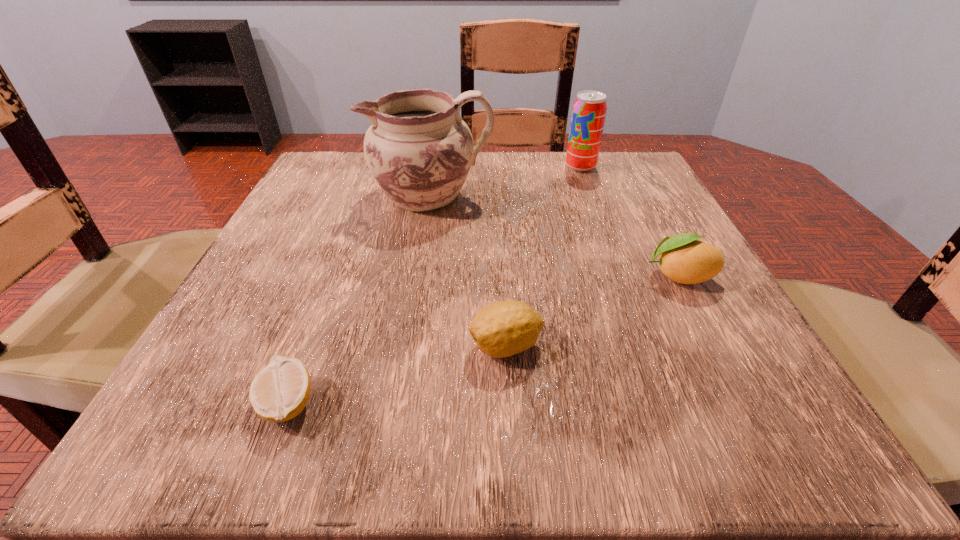
In order to click on pitcher that is at the far edge in this screenshot , I will do `click(419, 150)`.

Where is `soda can that is at the far edge`? soda can that is at the far edge is located at coordinates (589, 110).

Where is `object at the near edge`? object at the near edge is located at coordinates (279, 392).

The width and height of the screenshot is (960, 540). What are the coordinates of `pitcher at the left edge` in the screenshot? It's located at (419, 150).

Where is `lemon at the left edge`? This screenshot has height=540, width=960. lemon at the left edge is located at coordinates (279, 392).

Find the location of a particular element. This screenshot has width=960, height=540. soda can located in the right edge section of the desktop is located at coordinates (589, 110).

Find the location of `lemon at the right edge`. lemon at the right edge is located at coordinates (684, 259).

Where is `object situated at the far left corner`? object situated at the far left corner is located at coordinates (419, 150).

Locate an element on the screen. object positioned at the near left corner is located at coordinates (279, 392).

Find the location of a particular element. This screenshot has height=540, width=960. object located in the far right corner section of the desktop is located at coordinates (589, 110).